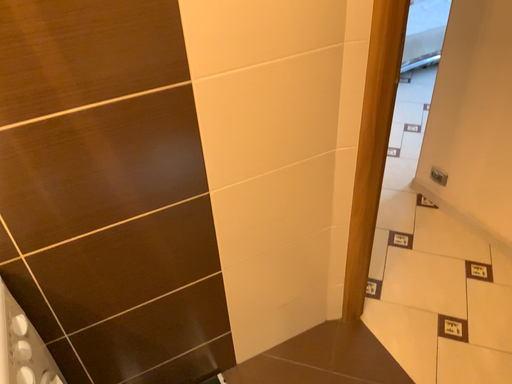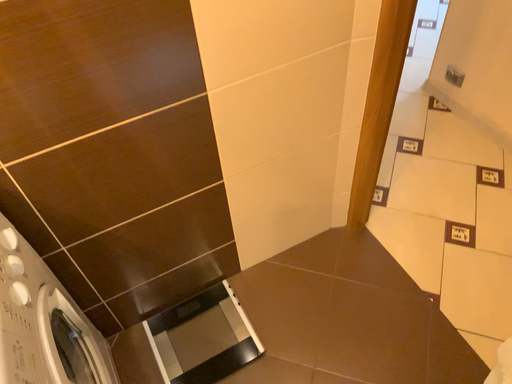
Question: Which way did the camera rotate in the video?

Choices:
 (A) rotated downward
 (B) rotated upward

Answer: (A)